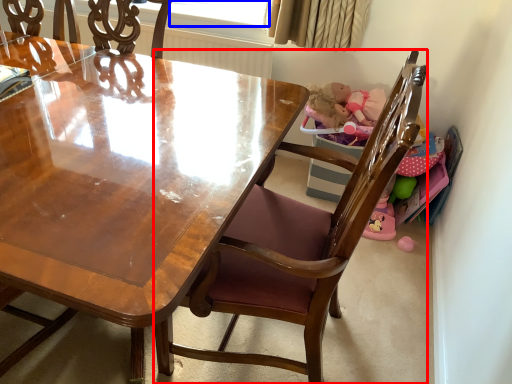
Question: Among these objects, which one is farthest to the camera, chair (highlighted by a red box) or window screen (highlighted by a blue box)?

Choices:
 (A) chair
 (B) window screen

Answer: (B)